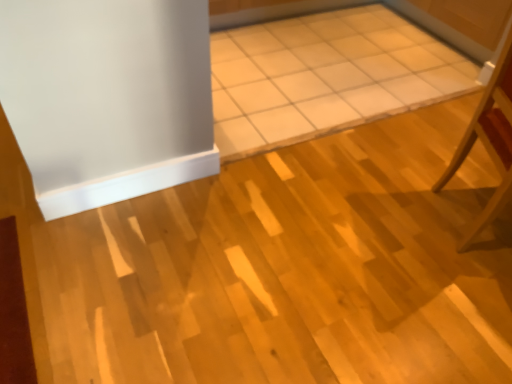
In order to click on free region on the left part of wooden folding chair at right in this screenshot , I will do `click(387, 215)`.